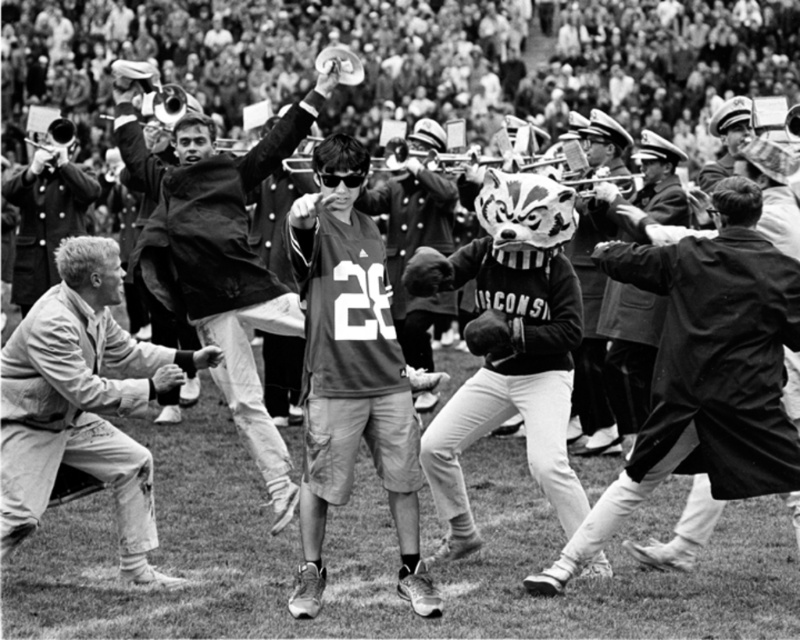
Does light beige cotton pants at lower left have a smaller size compared to matte black jersey at center?

Incorrect, light beige cotton pants at lower left is not smaller in size than matte black jersey at center.

Between point (66, 452) and point (440, 227), which one is positioned in front?

Positioned in front is point (66, 452).

Find the location of a particular element. This screenshot has height=640, width=800. light beige cotton pants at lower left is located at coordinates coord(84,403).

Does black matte mascot at center have a lesser width compared to matte black jersey at center?

Incorrect, black matte mascot at center's width is not less than matte black jersey at center's.

Does point (560, 192) lie behind point (412, 225)?

No, (560, 192) is closer to viewer.

Identify the location of black matte mascot at center. pos(508,346).

Is smooth black coat at center above matte jersey at center?

Indeed, smooth black coat at center is positioned over matte jersey at center.

Can you confirm if smooth black coat at center is thinner than matte jersey at center?

No.

Does point (746, 490) lie in front of point (320, 401)?

Yes.

Identify the location of smooth black coat at center. This screenshot has width=800, height=640. (705, 371).